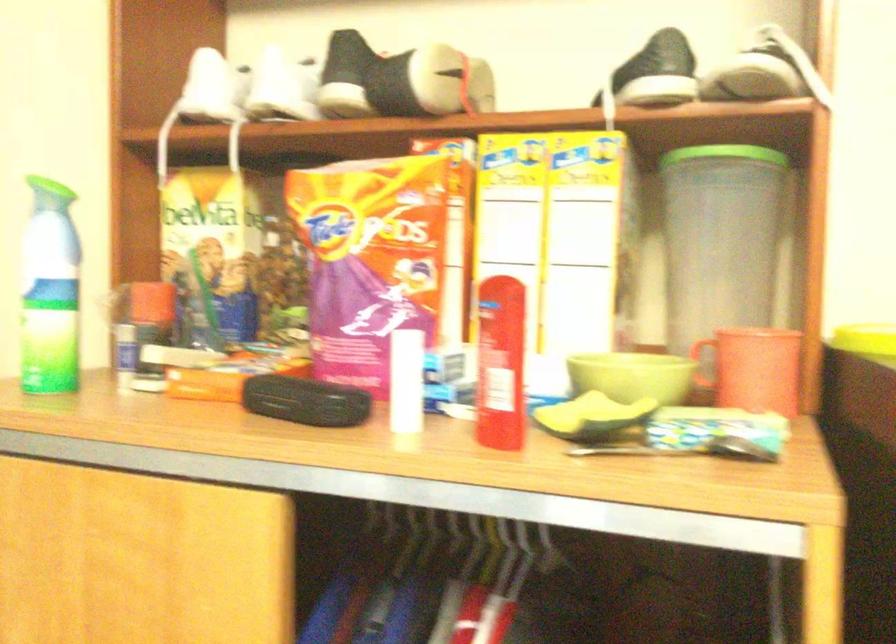
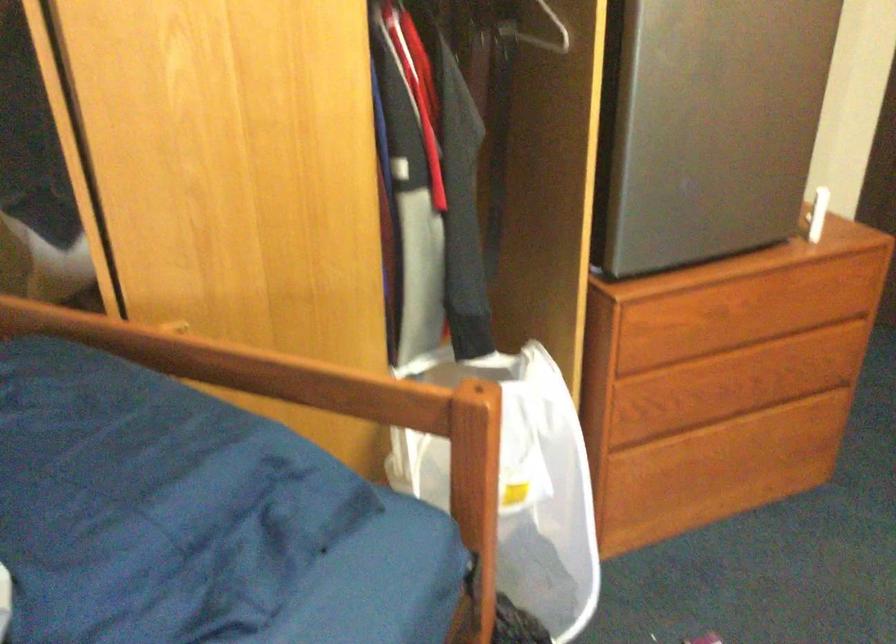
In the scene shown: Based on the continuous images, in which direction is the camera rotating?

The camera rotated toward right-down.